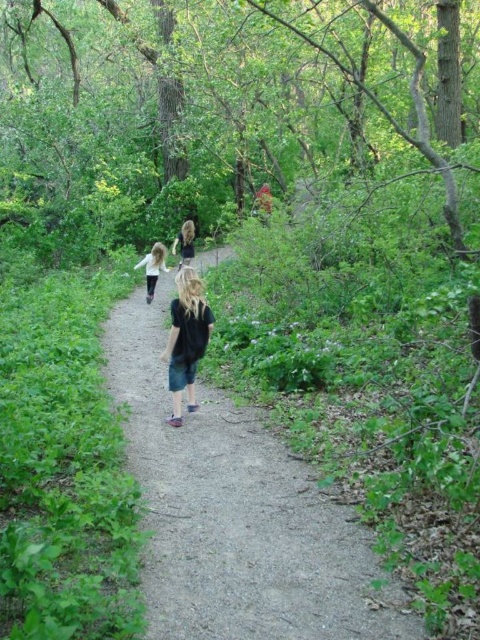
Between point (144, 269) and point (186, 221), which one is positioned behind?

The point (144, 269) is behind.

Is the position of white cotton shirt at center more distant than that of blonde hair at center?

No, white cotton shirt at center is closer to the viewer.

Which is behind, point (157, 268) or point (189, 234)?

The point (189, 234) is behind.

The height and width of the screenshot is (640, 480). Identify the location of white cotton shirt at center. (153, 268).

Who is more distant from viewer, (x=171, y=348) or (x=139, y=268)?

The point (x=139, y=268) is more distant.

Locate an element on the screen. Image resolution: width=480 pixels, height=640 pixels. denim shorts at center is located at coordinates (187, 339).

Where is `denim shorts at center`? This screenshot has height=640, width=480. denim shorts at center is located at coordinates (187, 339).

Find the location of `denim shorts at center`. denim shorts at center is located at coordinates (187, 339).

Who is shorter, denim shorts at center or blonde hair at center?

denim shorts at center

Describe the element at coordinates (187, 339) in the screenshot. I see `denim shorts at center` at that location.

Find the location of a particular element. The width and height of the screenshot is (480, 640). denim shorts at center is located at coordinates (187, 339).